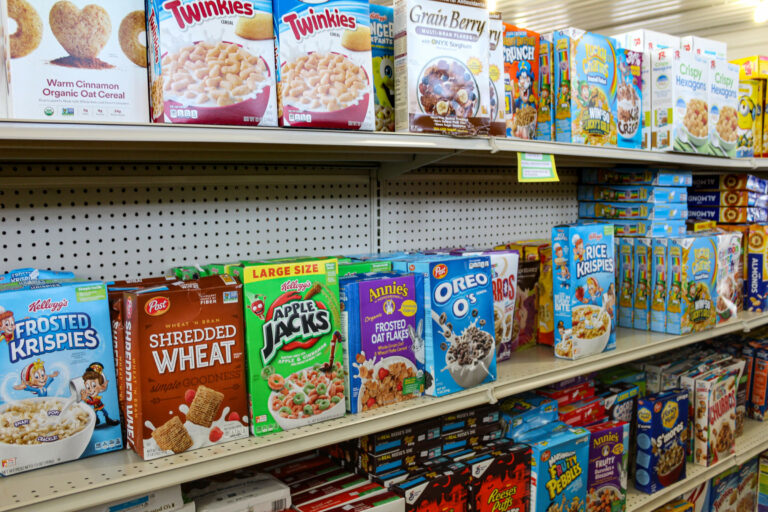
Where is `aisle shevles`? aisle shevles is located at coordinates (200, 141), (588, 143), (384, 411), (522, 384), (660, 490), (750, 449).